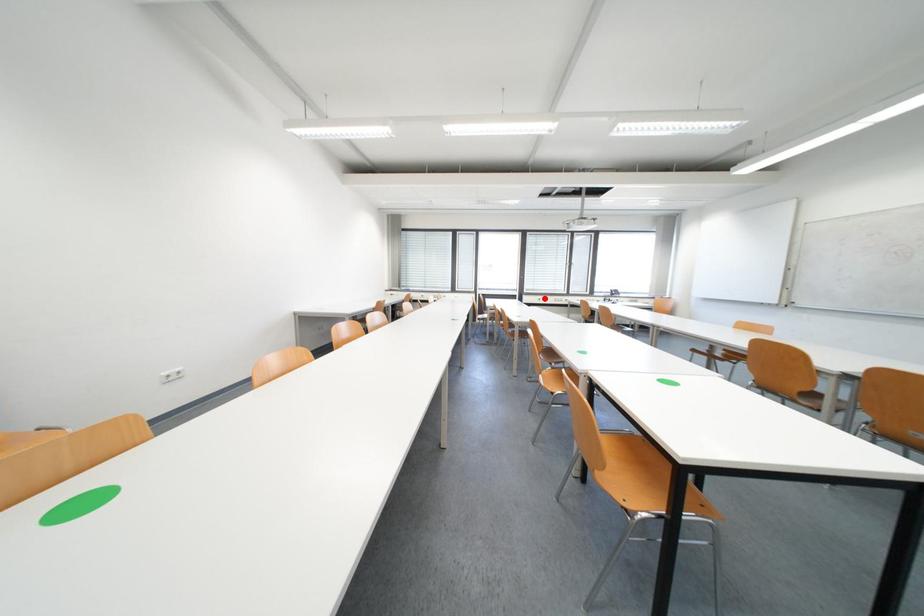
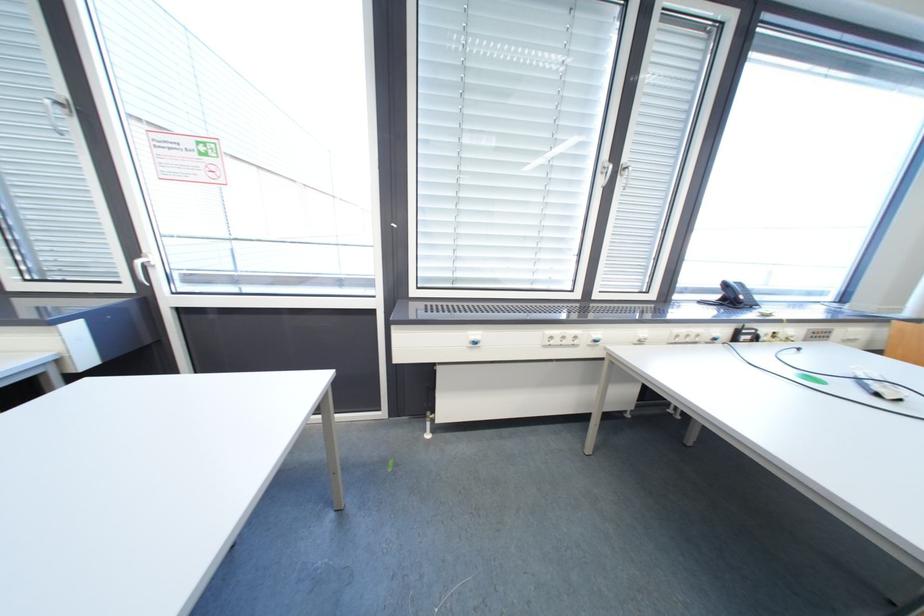
Where in the second image is the point corresponding to the highlighted location from the first image?

(480, 334)